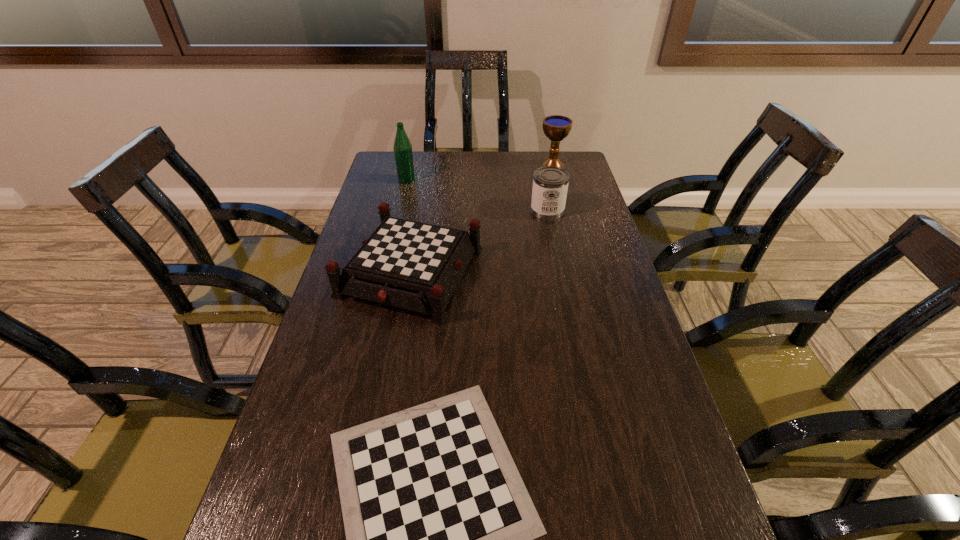
You are a GUI agent. You are given a task and a screenshot of the screen. Output one action in this format:
    pyautogui.click(x=<x>, y=<y>)
    Task: Click on the bottle
    The height and width of the screenshot is (540, 960).
    Given the screenshot: What is the action you would take?
    pyautogui.click(x=402, y=147)

What are the coordinates of `the fourth nearest object` in the screenshot? It's located at (402, 147).

Find the location of a particular element. This screenshot has height=540, width=960. the fourth shortest object is located at coordinates (556, 127).

This screenshot has width=960, height=540. I want to click on the farthest object, so click(556, 127).

Where is `the third farthest object`? the third farthest object is located at coordinates (550, 184).

Image resolution: width=960 pixels, height=540 pixels. Find the location of `the second shortest object`. the second shortest object is located at coordinates (412, 265).

At what (x,y) coordinates should I click in order to perform the action: click on checkerboard. Please return your answer as a coordinate pair (x, y). Looking at the image, I should click on (412, 265).

Find the location of a particular element. The height and width of the screenshot is (540, 960). free point located on the left of the bottle is located at coordinates [382, 180].

The width and height of the screenshot is (960, 540). In order to click on vacant position located on the front of the second tallest object in this screenshot , I will do `click(556, 178)`.

Where is `free spot located on the back of the third farthest object`? free spot located on the back of the third farthest object is located at coordinates (539, 167).